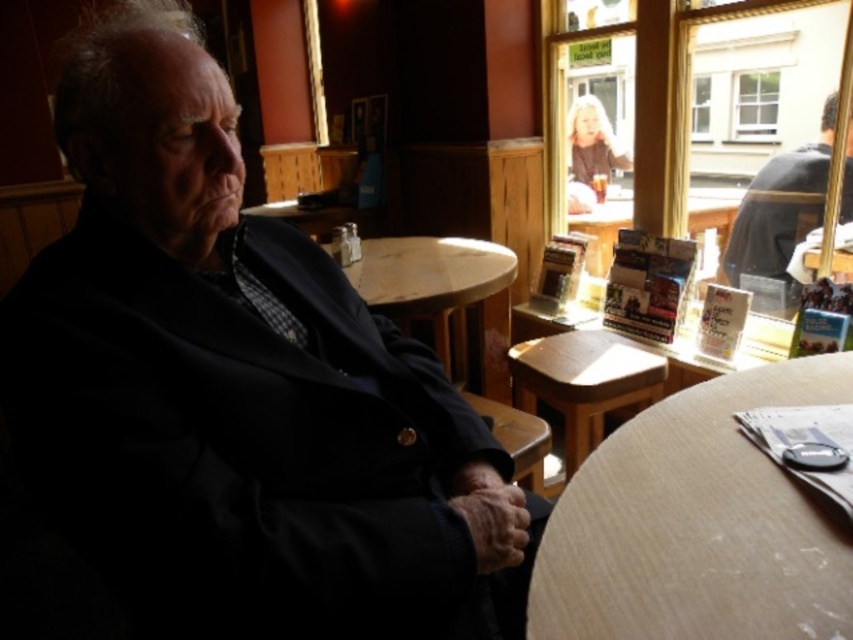
You are a customer in the cafe and want to place your coffee mug on the table. The table has a matte black jacket at left. Where should you place the mug so it doesn not interfere with the jacket?

Place the mug away from the matte black jacket at left, preferably on the opposite side of the table since the jacket is located at the left side.

From the picture: You are a waiter in a dimly lit restaurant. You need to place a customer order on the wooden at lower right and marble table at center. Which object should you place the order on first if you want to follow the left to right sequence?

You should place the order on the marble table at center first, then the wooden at lower right because the wooden at lower right is to the right of the marble table at center according to the description.

You are standing in the cozy cafe and want to place a small vase on the table in front of the man. The vase is 10 centimeters in diameter. Can you estimate if there is enough space between the point at (345, 545) and the edge of the table to place the vase?

The point at (345, 545) is 73.23 centimeters away from the viewer. Since the vase is only 10 centimeters in diameter, there should be sufficient space between the point and the table edge to place the vase.